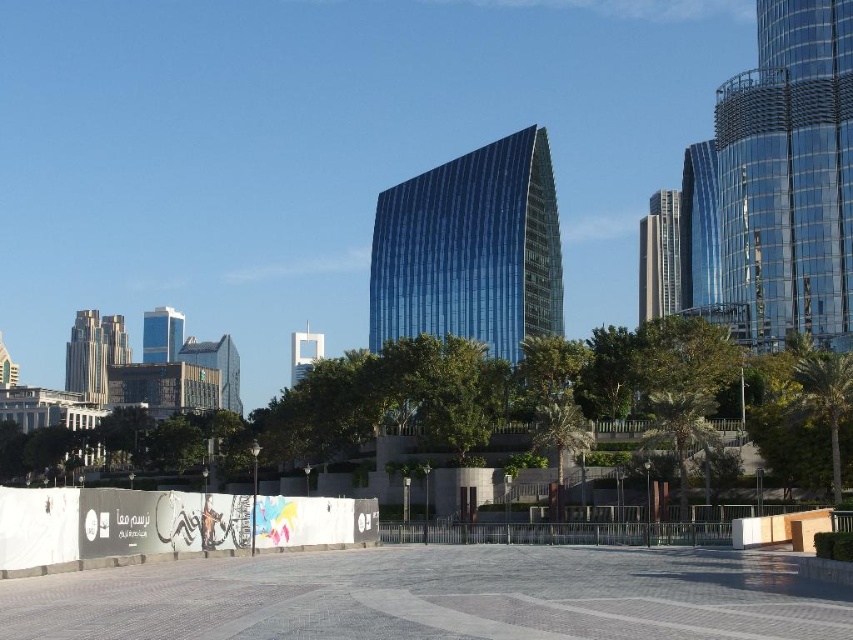
You are standing at the center of the paved area in the foreground. You want to take a photo of the metallic glass skyscraper at right. Which direction should you face to capture it in your view?

The metallic glass skyscraper at right is located at point [659,257], which is to the right side of the scene. To capture it in your view, you should face towards the right direction from your current position at the center of the paved area.

Looking at this image, you are a city planner reviewing the layout of this urban area. You need to determine the spatial relationship between the blue glass building at center and the matte gray building at left. Which building is located to the right of the other?

The blue glass building at center is positioned on the right side of matte gray building at left.

Based on the scene description, what is the 2D coordinate of the blue glass building at center?

The blue glass building at center is located at the 2D coordinate point of (469, 250).